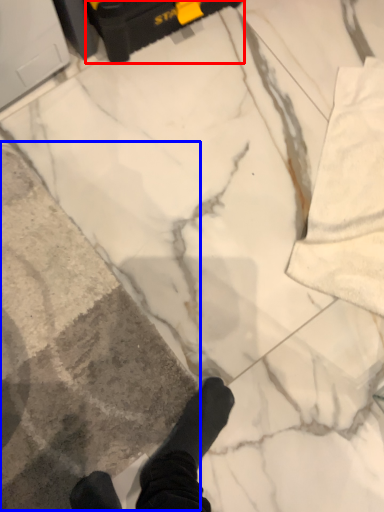
Question: Which point is further to the camera, equipment (highlighted by a red box) or concrete (highlighted by a blue box)?

Choices:
 (A) equipment
 (B) concrete

Answer: (A)